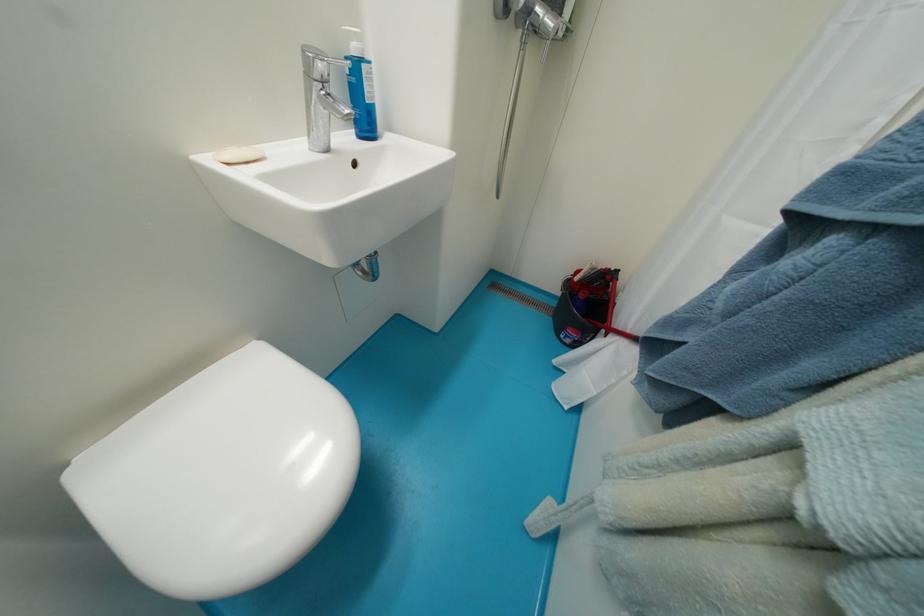
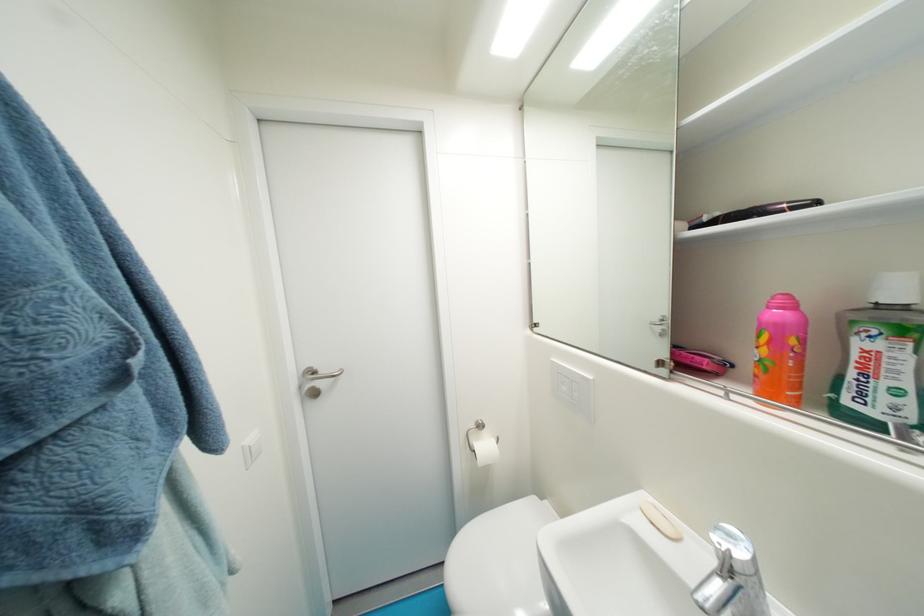
Locate, in the second image, the point that corresponds to the point at 253,166 in the first image.

(659, 525)